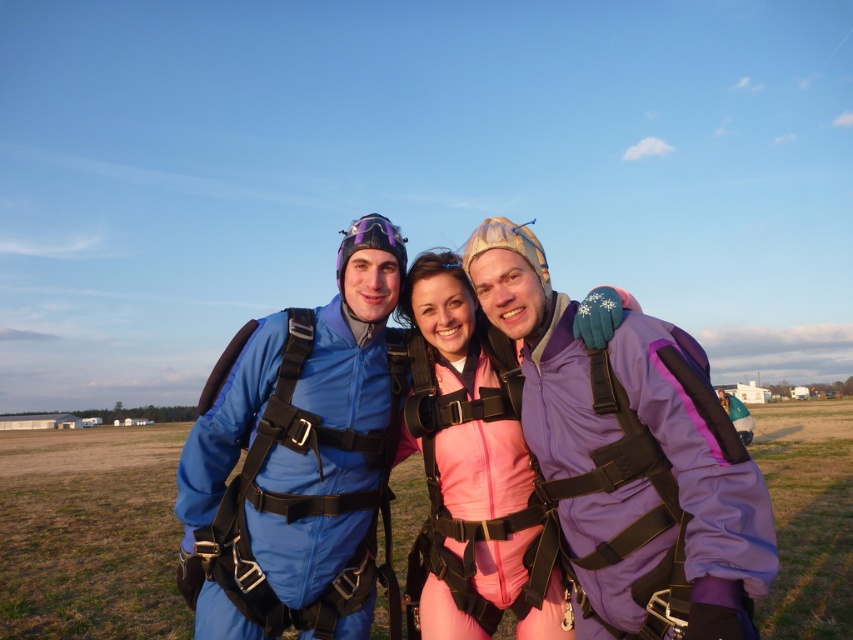
Is pink fabric jumpsuit at center shorter than purple matte/glossy goggles at center?

No.

Is pink fabric jumpsuit at center closer to camera compared to purple matte/glossy goggles at center?

Yes, pink fabric jumpsuit at center is closer to the viewer.

Identify the location of pink fabric jumpsuit at center. (462, 458).

Can you confirm if matte blue jumpsuit at center is wider than purple matte jumpsuit at center?

Yes, matte blue jumpsuit at center is wider than purple matte jumpsuit at center.

Is matte blue jumpsuit at center bigger than purple matte jumpsuit at center?

No.

Which is in front, point (234, 440) or point (548, 397)?

Positioned in front is point (548, 397).

I want to click on matte blue jumpsuit at center, so click(x=294, y=467).

Between purple matte jumpsuit at center and purple matte/glossy goggles at center, which one is positioned lower?

purple matte jumpsuit at center is lower down.

Can you confirm if purple matte jumpsuit at center is wider than purple matte/glossy goggles at center?

No, purple matte jumpsuit at center is not wider than purple matte/glossy goggles at center.

Does point (581, 461) lie in front of point (383, 246)?

That is True.

Find the location of a particular element. purple matte jumpsuit at center is located at coordinates (630, 454).